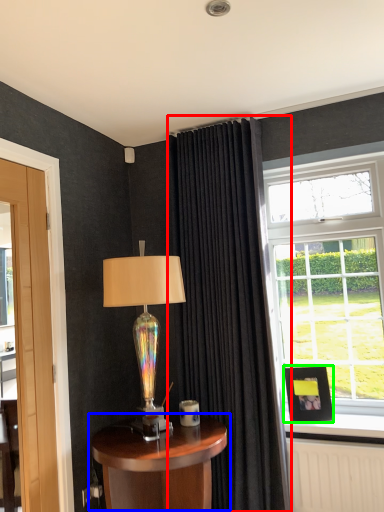
Question: Estimate the real-world distances between objects in this image. Which object is closer to curtain (highlighted by a red box), table (highlighted by a blue box) or picture frame (highlighted by a green box)?

Choices:
 (A) table
 (B) picture frame

Answer: (B)